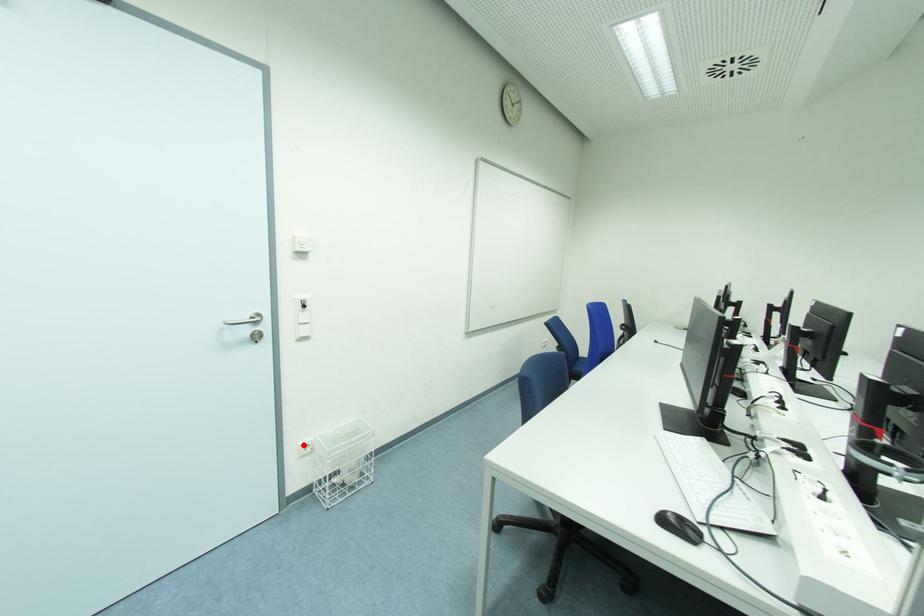
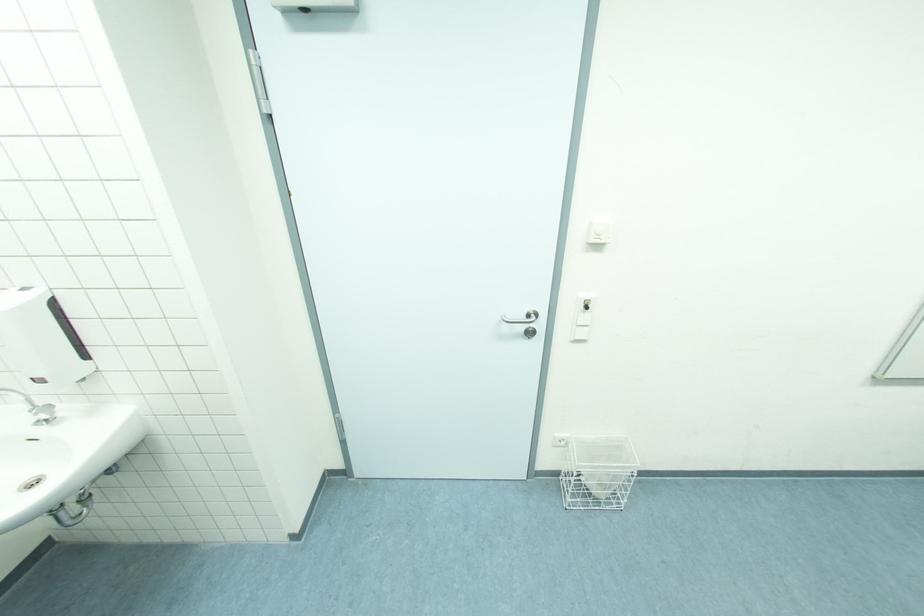
Locate, in the second image, the point that corresponds to the highlighted location in the first image.

(560, 437)